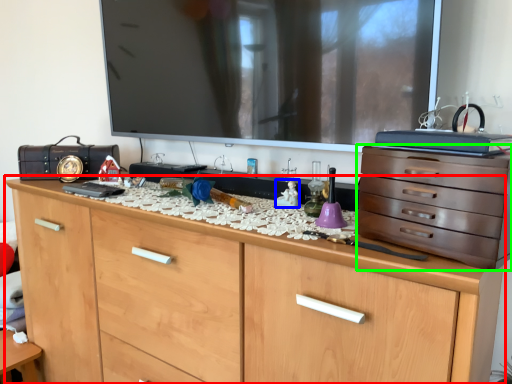
Question: Based on their relative distances, which object is nearer to chest of drawers (highlighted by a red box)? Choose from toy (highlighted by a blue box) and chest of drawers (highlighted by a green box).

Choices:
 (A) toy
 (B) chest of drawers

Answer: (B)